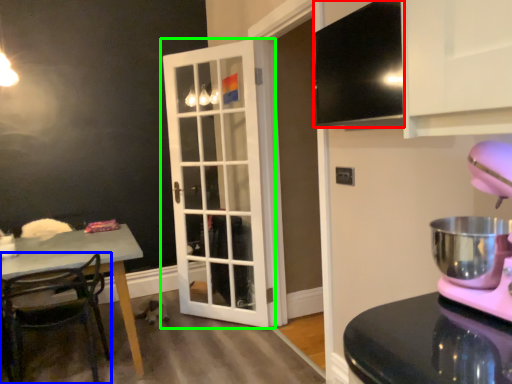
Question: Which object is positioned farthest from exhaust hood (highlighted by a red box)? Select from chair (highlighted by a blue box) and door (highlighted by a green box).

Choices:
 (A) chair
 (B) door

Answer: (A)